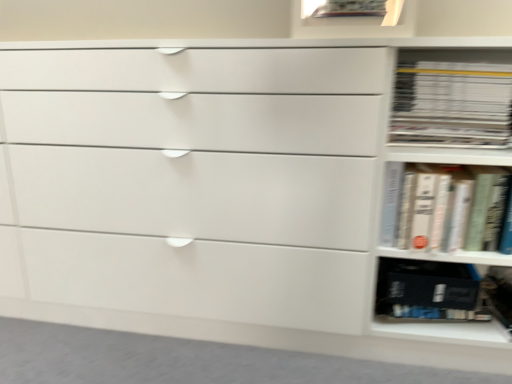
Question: Can you confirm if white matte book at right, placed as the 2th book when sorted from top to bottom, is bigger than white glossy book at right, which is counted as the first book, starting from the top?

Choices:
 (A) yes
 (B) no

Answer: (A)

Question: Is white matte book at right, placed as the 2th book when sorted from top to bottom, positioned beyond the bounds of white glossy book at right, which is counted as the first book, starting from the top?

Choices:
 (A) yes
 (B) no

Answer: (A)

Question: Considering the relative sizes of white matte book at right, acting as the first book starting from the bottom, and white glossy book at right, which is counted as the first book, starting from the top, in the image provided, is white matte book at right, acting as the first book starting from the bottom, thinner than white glossy book at right, which is counted as the first book, starting from the top,?

Choices:
 (A) no
 (B) yes

Answer: (B)

Question: Can you confirm if white matte book at right, placed as the 2th book when sorted from top to bottom, is taller than white glossy book at right, which is counted as the first book, starting from the top?

Choices:
 (A) yes
 (B) no

Answer: (A)

Question: From the image's perspective, would you say white matte book at right, acting as the first book starting from the bottom, is shown under white glossy book at right, which is counted as the first book, starting from the top?

Choices:
 (A) no
 (B) yes

Answer: (B)

Question: From their relative heights in the image, would you say black matte book at lower right is taller or shorter than white glossy book at right, which is the 2th book from bottom to top?

Choices:
 (A) tall
 (B) short

Answer: (B)

Question: From the image's perspective, is black matte book at lower right positioned above or below white glossy book at right, which is counted as the first book, starting from the top?

Choices:
 (A) above
 (B) below

Answer: (B)

Question: Based on their sizes in the image, would you say black matte book at lower right is bigger or smaller than white glossy book at right, which is counted as the first book, starting from the top?

Choices:
 (A) big
 (B) small

Answer: (B)

Question: Relative to white glossy book at right, which is counted as the first book, starting from the top, is black matte book at lower right in front or behind?

Choices:
 (A) front
 (B) behind

Answer: (B)

Question: From their relative heights in the image, would you say white matte book at right, acting as the first book starting from the bottom, is taller or shorter than white glossy book at right, which is counted as the first book, starting from the top?

Choices:
 (A) short
 (B) tall

Answer: (B)

Question: In terms of size, does white matte book at right, acting as the first book starting from the bottom, appear bigger or smaller than white glossy book at right, which is the 2th book from bottom to top?

Choices:
 (A) small
 (B) big

Answer: (B)

Question: Relative to white glossy book at right, which is counted as the first book, starting from the top, is white matte book at right, placed as the 2th book when sorted from top to bottom, in front or behind?

Choices:
 (A) front
 (B) behind

Answer: (A)

Question: Is point (482, 221) positioned closer to the camera than point (452, 104)?

Choices:
 (A) closer
 (B) farther

Answer: (A)

Question: From a real-world perspective, is white glossy book at right, which is counted as the first book, starting from the top, positioned above or below white matte book at right, placed as the 2th book when sorted from top to bottom?

Choices:
 (A) below
 (B) above

Answer: (B)

Question: Do you think white glossy book at right, which is counted as the first book, starting from the top, is within white matte book at right, placed as the 2th book when sorted from top to bottom, or outside of it?

Choices:
 (A) inside
 (B) outside

Answer: (B)